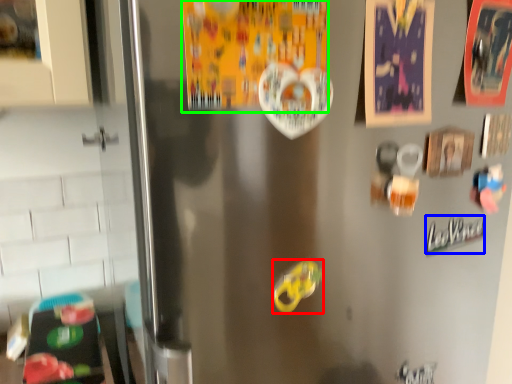
Question: Which object is the farthest from food (highlighted by a red box)? Choose among these: writing (highlighted by a blue box) or postcard (highlighted by a green box).

Choices:
 (A) writing
 (B) postcard

Answer: (A)